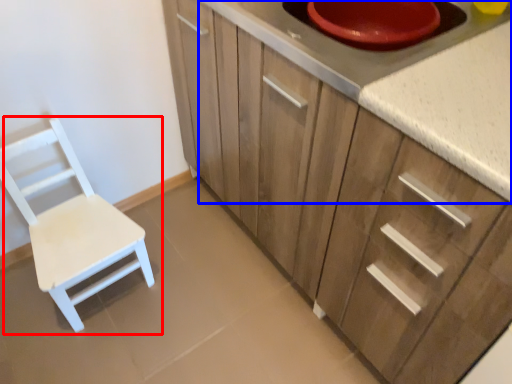
Question: Which point is closer to the camera, chair (highlighted by a red box) or countertop (highlighted by a blue box)?

Choices:
 (A) chair
 (B) countertop

Answer: (B)